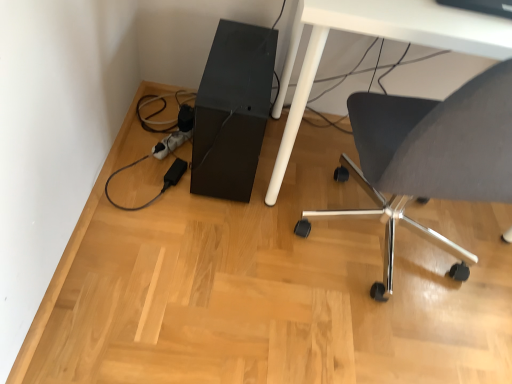
The image size is (512, 384). In order to click on vacant point above black matte computer tower at lower center (from a real-world perspective) in this screenshot , I will do `click(240, 60)`.